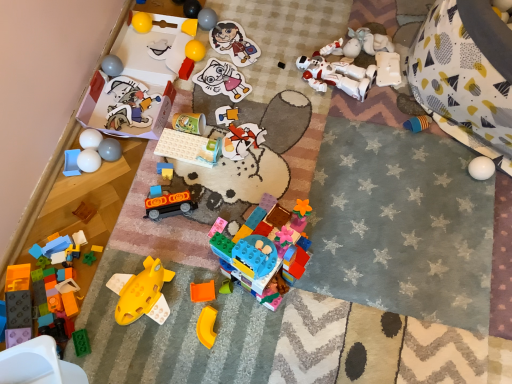
At what (x,y) coordinates should I click in order to perform the action: click on free space that is in between white plastic robot at upper right, which appears as the second toy when viewed from the right, and black plastic train at center, the 14th toy from the right. Please return your answer as a coordinate pair (x, y). The height and width of the screenshot is (384, 512). Looking at the image, I should click on (282, 144).